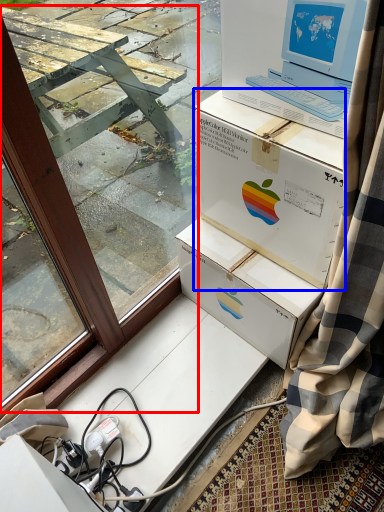
Question: Which of the following is the farthest to the observer, window frame (highlighted by a red box) or box (highlighted by a blue box)?

Choices:
 (A) window frame
 (B) box

Answer: (B)